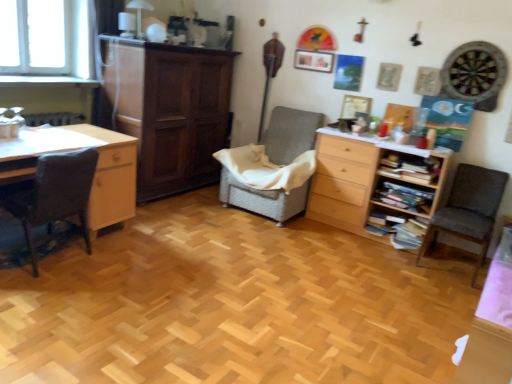
Locate an element on the screen. This screenshot has height=384, width=512. empty space that is in between light wood desk at left and light wood chest of drawers at center right is located at coordinates (231, 240).